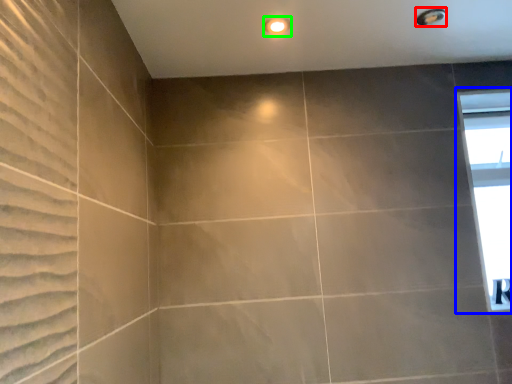
Question: Which object is positioned closest to shower (highlighted by a red box)? Select from window (highlighted by a blue box) and lighting (highlighted by a green box).

Choices:
 (A) window
 (B) lighting

Answer: (B)